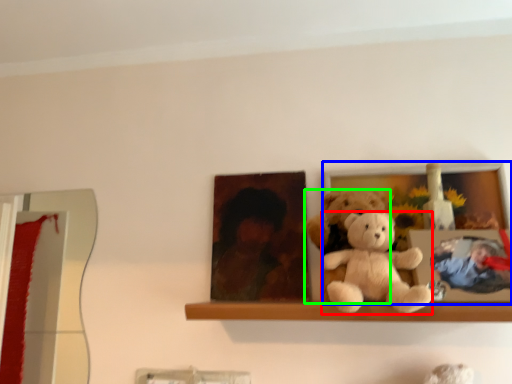
Question: Which object is positioned closest to teddy bear (highlighted by a red box)? Select from picture frame (highlighted by a blue box) and teddy bear (highlighted by a green box).

Choices:
 (A) picture frame
 (B) teddy bear

Answer: (B)